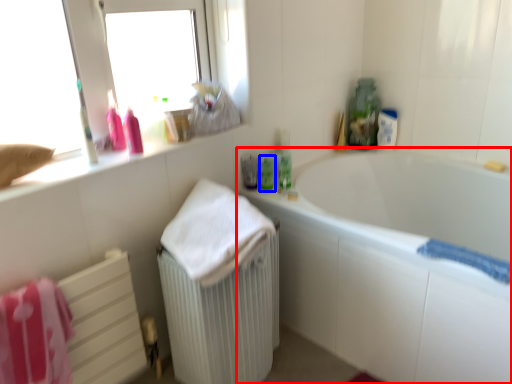
Question: Which of the following is the farthest to the observer, bathtub (highlighted by a red box) or mouthwash (highlighted by a blue box)?

Choices:
 (A) bathtub
 (B) mouthwash

Answer: (B)